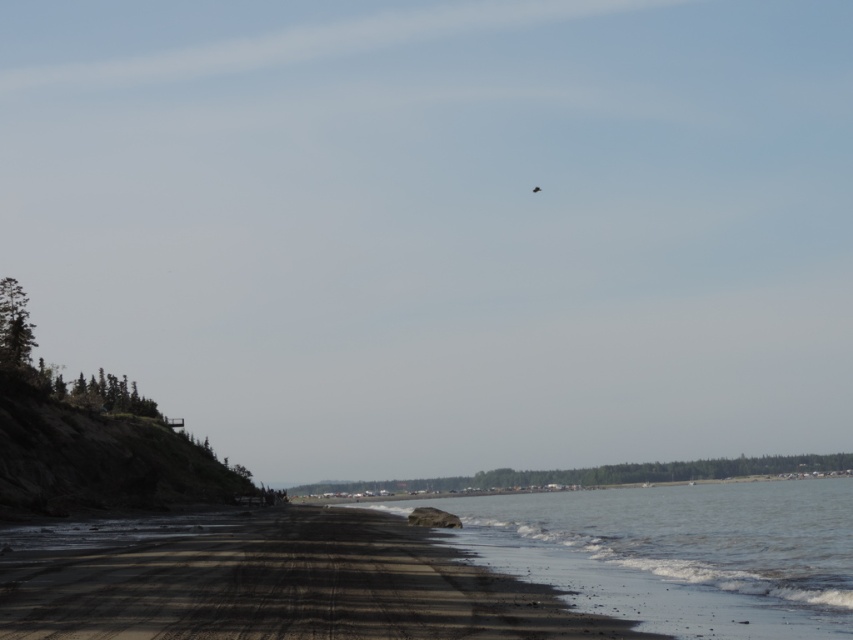
Based on the photo, does dark sand beach at lower left have a lesser width compared to black sand at lower right?

Yes.

Does dark sand beach at lower left have a greater height compared to black sand at lower right?

No, dark sand beach at lower left is not taller than black sand at lower right.

Find the location of a particular element. dark sand beach at lower left is located at coordinates (273, 582).